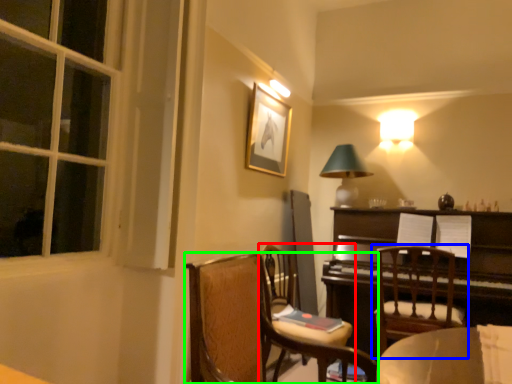
Question: Estimate the real-world distances between objects in this image. Which object is closer to chair (highlighted by a red box), chair (highlighted by a blue box) or chair (highlighted by a green box)?

Choices:
 (A) chair
 (B) chair

Answer: (B)